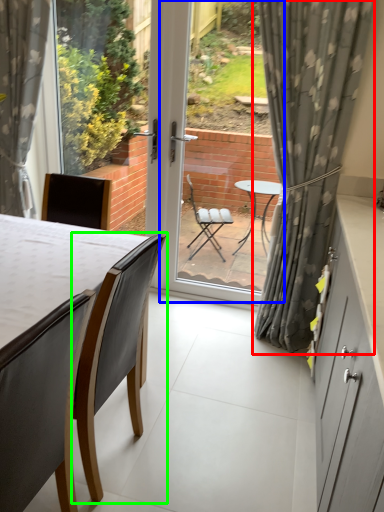
Question: Considering the real-world distances, which object is farthest from curtain (highlighted by a red box)? glass door (highlighted by a blue box) or chair (highlighted by a green box)?

Choices:
 (A) glass door
 (B) chair

Answer: (A)